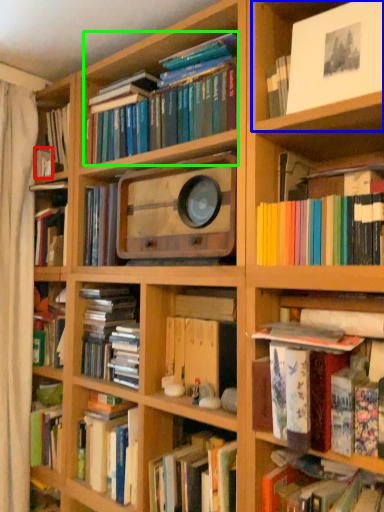
Question: Considering the real-world distances, which object is closest to book (highlighted by a red box)? cabinet (highlighted by a blue box) or book (highlighted by a green box).

Choices:
 (A) cabinet
 (B) book

Answer: (B)